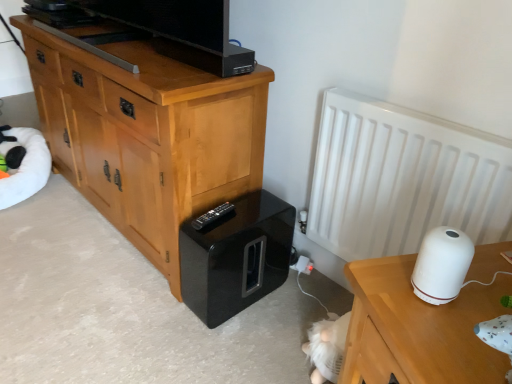
Question: Based on their sizes in the image, would you say white glossy humidifier at right is bigger or smaller than light brown wood chest of drawers at left?

Choices:
 (A) small
 (B) big

Answer: (A)

Question: Is point (423, 243) positioned closer to the camera than point (31, 66)?

Choices:
 (A) closer
 (B) farther

Answer: (A)

Question: Estimate the real-world distances between objects in this image. Which object is farther from the white matte radiator at right?

Choices:
 (A) black plastic remote at lower center
 (B) glossy black speaker at lower center
 (C) white glossy humidifier at right
 (D) white matte table at right
 (E) white plush bean bag at left

Answer: (E)

Question: Which is nearer to the black plastic remote at lower center?

Choices:
 (A) light brown wood chest of drawers at left
 (B) glossy black speaker at lower center
 (C) white matte radiator at right
 (D) white plush bean bag at left
 (E) white matte table at right

Answer: (B)